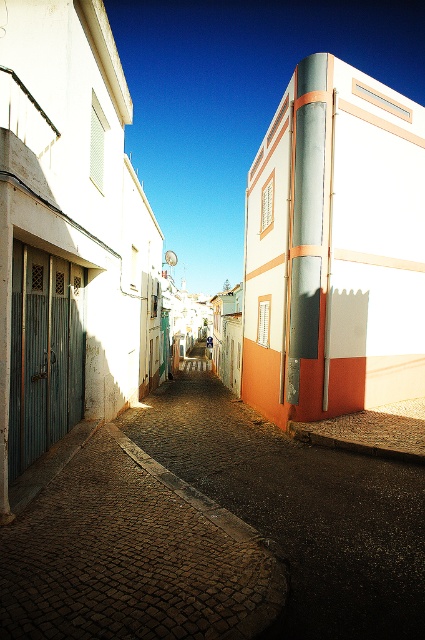
In the scene shown: Does cobblestone alley at center have a lesser height compared to cobblestone street at center?

Incorrect, cobblestone alley at center's height does not fall short of cobblestone street at center's.

Who is more forward, (17, 636) or (153, 513)?

Point (17, 636)

Locate an element on the screen. cobblestone alley at center is located at coordinates (214, 534).

Is point (354, 112) closer to camera compared to point (51, 592)?

That is False.

Is metallic silver pipe at center below cobblestone street at center?

Actually, metallic silver pipe at center is above cobblestone street at center.

Does point (272, 285) come farther from viewer compared to point (130, 445)?

That is True.

Identify the location of metallic silver pipe at center. (334, 248).

Who is higher up, cobblestone alley at center or metallic silver pipe at center?

metallic silver pipe at center

Looking at this image, does cobblestone alley at center have a lesser height compared to metallic silver pipe at center?

Yes, cobblestone alley at center is shorter than metallic silver pipe at center.

Is point (255, 486) positioned behind point (263, 326)?

No, (255, 486) is closer to viewer.

The height and width of the screenshot is (640, 425). Identify the location of cobblestone alley at center. (214, 534).